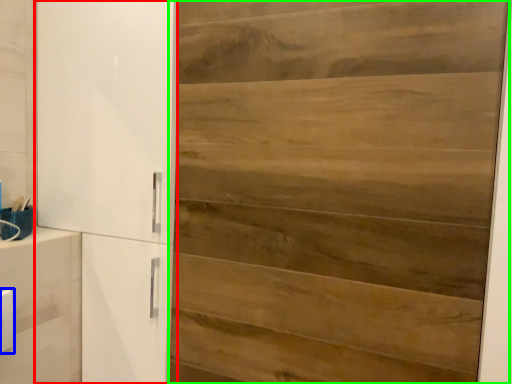
Question: Based on their relative distances, which object is nearer to cupboard (highlighted by a red box)? Choose from light switch (highlighted by a blue box) and door (highlighted by a green box).

Choices:
 (A) light switch
 (B) door

Answer: (B)